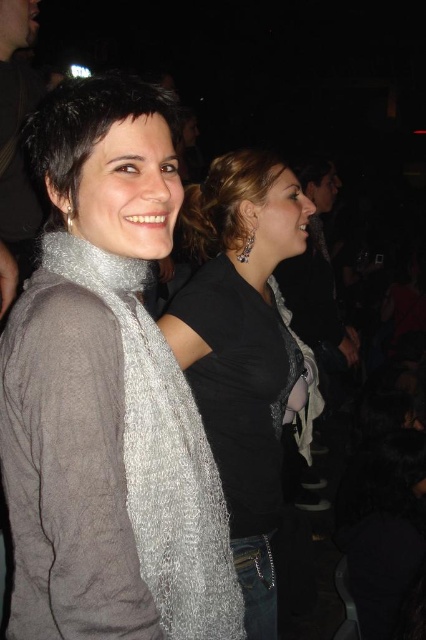
You are at a social event and want to identify the person with the smaller object on their head. Which person should you approach, the one with matte black hair at upper center or the one with silver metallic scarf at left?

The matte black hair at upper center has a smaller size compared to the silver metallic scarf at left, so you should approach the person with matte black hair at upper center.

You are at a social event and notice two people standing near you. You see a silver textured scarf at center and a silver textured scarf at left. Which scarf appears taller?

The silver textured scarf at center is much taller than the silver textured scarf at left.

You are at a social event and want to take a photo of the silver textured scarf at center without getting too close. The camera you have can focus clearly up to 3 feet. Is the camera able to capture the scarf clearly from your current position?

The silver textured scarf at center and camera are 3.60 feet apart. Since the camera can focus up to 3 feet, the distance is too far for clear focus. Move closer to ensure the scarf is within 3 feet for a sharp photo.